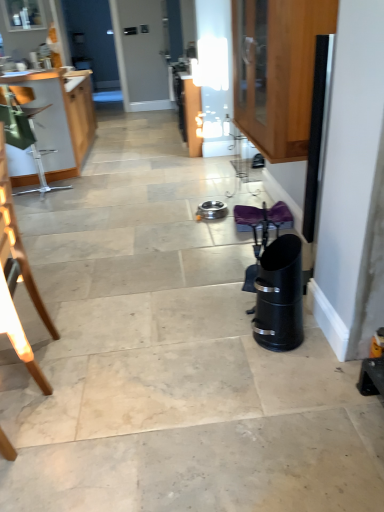
In order to click on spots to the right of wooden chair at left in this screenshot , I will do `click(89, 364)`.